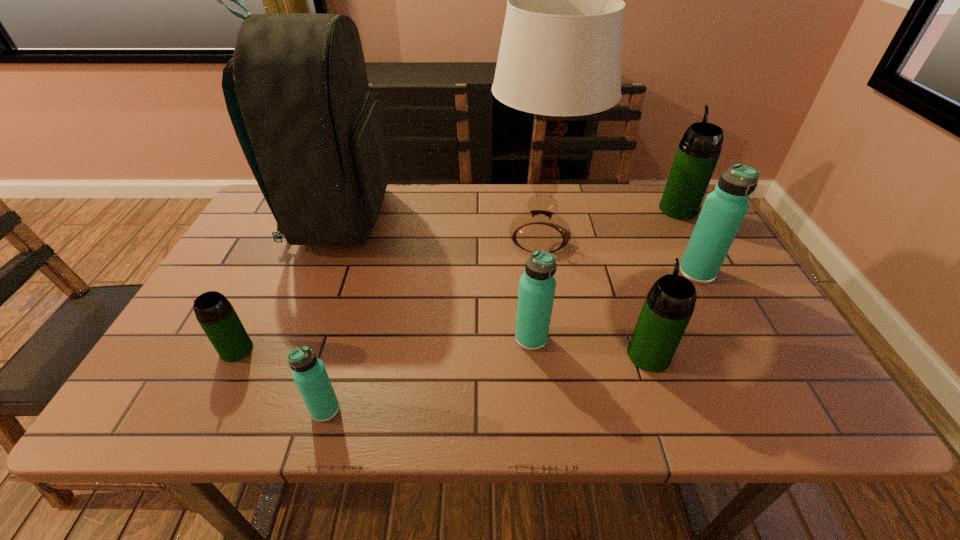
This screenshot has height=540, width=960. In order to click on vacant region between the second smallest green thermos bottle and the nearest thermos bottle in this screenshot , I will do `click(487, 382)`.

Locate an element on the screen. The width and height of the screenshot is (960, 540). empty location between the leftmost green thermos bottle and the backpack is located at coordinates (288, 284).

The height and width of the screenshot is (540, 960). In order to click on vacant space that's between the backpack and the third thermos bottle from left to right in this screenshot , I will do `click(436, 279)`.

Locate an element on the screen. This screenshot has width=960, height=540. free space between the backpack and the farthest thermos bottle is located at coordinates (509, 214).

This screenshot has height=540, width=960. Identify the location of empty space between the second biggest aqua thermos bottle and the fifth thermos bottle from right to left. (428, 374).

Locate an element on the screen. The width and height of the screenshot is (960, 540). vacant space that's between the leftmost thermos bottle and the rightmost green thermos bottle is located at coordinates (457, 280).

At what (x,y) coordinates should I click in order to perform the action: click on vacant space that is in between the farthest aqua thermos bottle and the fifth thermos bottle from right to left. Please return your answer as a coordinate pair (x, y). Looking at the image, I should click on (511, 341).

I want to click on the seventh closest object to the fifth nearest thermos bottle, so click(x=216, y=315).

Find the location of `object that can be found as the sixth closest to the backpack`. object that can be found as the sixth closest to the backpack is located at coordinates (724, 209).

This screenshot has width=960, height=540. I want to click on the fifth closest thermos bottle relative to the table lamp, so click(309, 373).